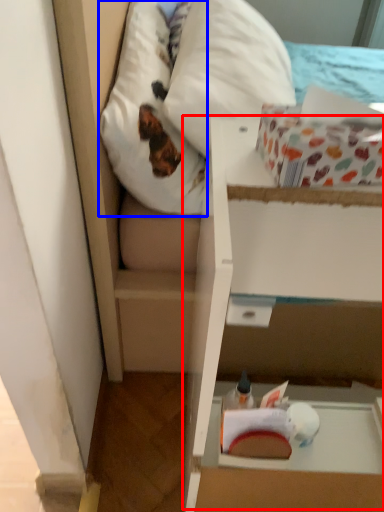
Question: Which object is further to the camera taking this photo, cardboard box (highlighted by a red box) or pillow (highlighted by a blue box)?

Choices:
 (A) cardboard box
 (B) pillow

Answer: (B)